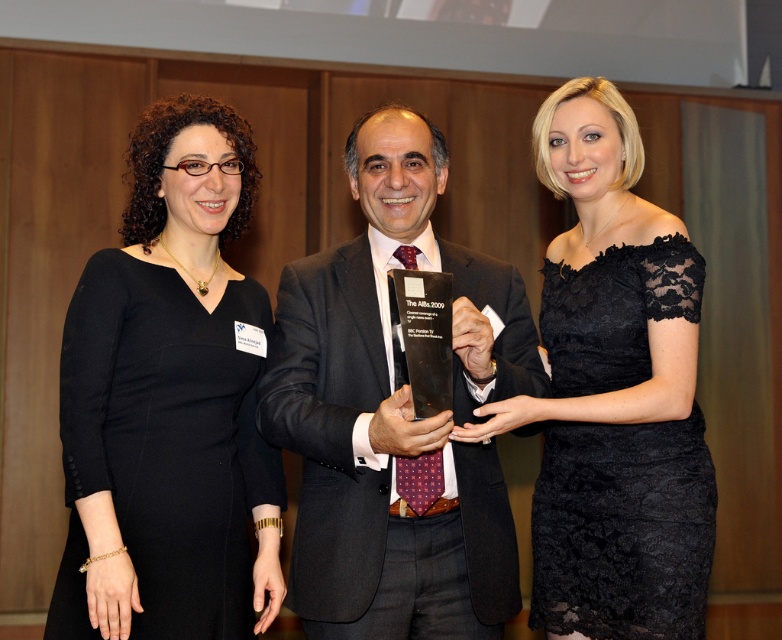
Question: Which object is the farthest from the black lace dress at center?

Choices:
 (A) black matte dress at left
 (B) shiny black suit at center

Answer: (A)

Question: Observing the image, what is the correct spatial positioning of black matte dress at left in reference to black lace dress at center?

Choices:
 (A) left
 (B) right

Answer: (A)

Question: Among these points, which one is farthest from the camera?

Choices:
 (A) (235, 460)
 (B) (353, 586)

Answer: (A)

Question: In this image, where is black matte dress at left located relative to black lace dress at center?

Choices:
 (A) above
 (B) below

Answer: (B)

Question: Considering the real-world distances, which object is closest to the shiny black suit at center?

Choices:
 (A) black matte dress at left
 (B) black lace dress at center

Answer: (B)

Question: In this image, where is black matte dress at left located relative to shiny black suit at center?

Choices:
 (A) left
 (B) right

Answer: (A)